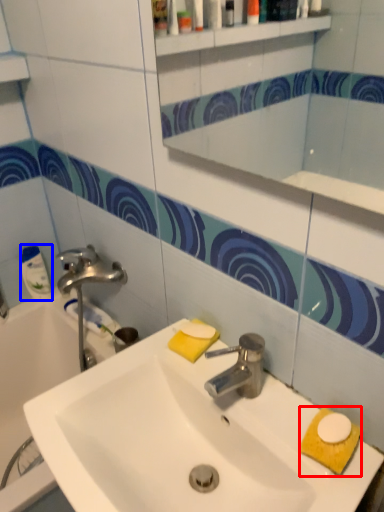
Question: Among these objects, which one is nearest to the camera, hand towel (highlighted by a red box) or cleaning product (highlighted by a blue box)?

Choices:
 (A) hand towel
 (B) cleaning product

Answer: (A)